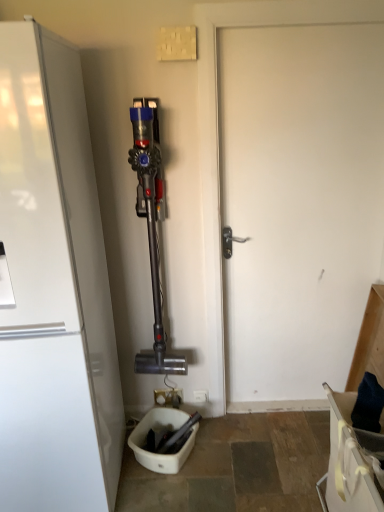
Question: From the image's perspective, is white matte door at center under white plastic electric outlet at center?

Choices:
 (A) yes
 (B) no

Answer: (B)

Question: Is white matte door at center thinner than white plastic electric outlet at center?

Choices:
 (A) yes
 (B) no

Answer: (B)

Question: Does white matte door at center lie in front of white plastic electric outlet at center?

Choices:
 (A) yes
 (B) no

Answer: (A)

Question: Does white matte door at center turn towards white plastic electric outlet at center?

Choices:
 (A) no
 (B) yes

Answer: (A)

Question: Can you confirm if white matte door at center is wider than white plastic electric outlet at center?

Choices:
 (A) yes
 (B) no

Answer: (A)

Question: Is white matte door at center smaller than white plastic electric outlet at center?

Choices:
 (A) no
 (B) yes

Answer: (A)

Question: Is white plastic electric outlet at center placed right next to white glossy refrigerator at left?

Choices:
 (A) yes
 (B) no

Answer: (B)

Question: Can you confirm if white plastic electric outlet at center is thinner than white glossy refrigerator at left?

Choices:
 (A) yes
 (B) no

Answer: (A)

Question: Is white plastic electric outlet at center not close to white glossy refrigerator at left?

Choices:
 (A) no
 (B) yes

Answer: (B)

Question: Would you say white plastic electric outlet at center is outside white glossy refrigerator at left?

Choices:
 (A) no
 (B) yes

Answer: (B)

Question: From a real-world perspective, is white plastic electric outlet at center located higher than white glossy refrigerator at left?

Choices:
 (A) no
 (B) yes

Answer: (A)

Question: From the image's perspective, is white plastic electric outlet at center located beneath white glossy refrigerator at left?

Choices:
 (A) yes
 (B) no

Answer: (A)

Question: From a real-world perspective, is white glossy refrigerator at left below white plastic electric outlet at center?

Choices:
 (A) yes
 (B) no

Answer: (B)